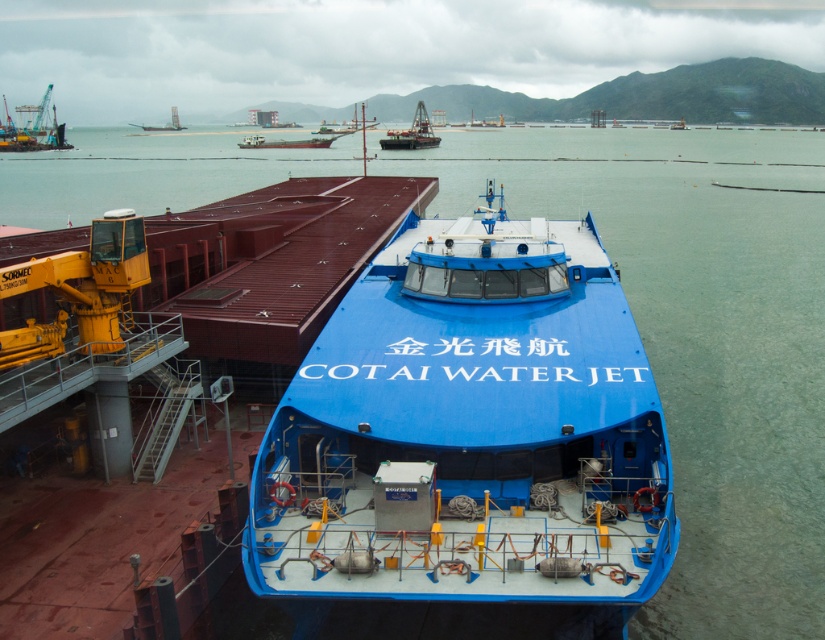
Question: Is blue metallic boat at center wider than metallic gray boat at upper center?

Choices:
 (A) yes
 (B) no

Answer: (B)

Question: Observing the image, what is the correct spatial positioning of blue matte boat at center in reference to brown matte boat at center?

Choices:
 (A) above
 (B) below

Answer: (B)

Question: Which object is the closest to the blue metallic boat at center?

Choices:
 (A) metallic gray boat at upper center
 (B) blue matte boat at center
 (C) brown matte boat at center

Answer: (C)

Question: Which of the following is the farthest from the observer?

Choices:
 (A) (168, 125)
 (B) (409, 140)
 (C) (267, 147)

Answer: (A)

Question: Considering the relative positions of brown matte boat at center and metallic gray boat at upper center in the image provided, where is brown matte boat at center located with respect to metallic gray boat at upper center?

Choices:
 (A) above
 (B) below

Answer: (B)

Question: Which object appears farthest from the camera in this image?

Choices:
 (A) brown matte boat at center
 (B) blue metallic boat at center

Answer: (A)